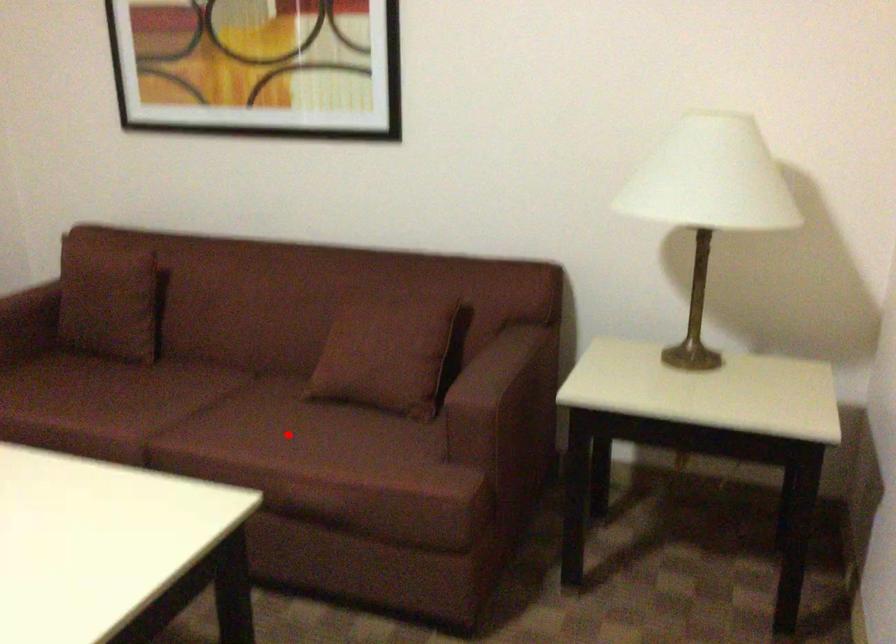
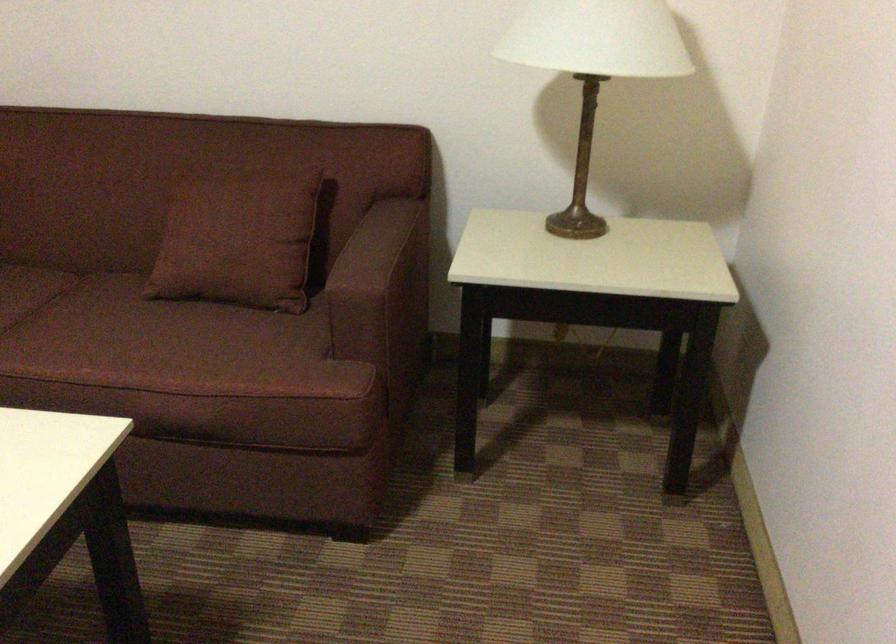
Question: I am providing you with two images of the same scene from different viewpoints. Image1 has a red point marked. In image2, the corresponding 3D location appears at what relative position? Reply with the corresponding letter.

Choices:
 (A) Closer
 (B) Farther

Answer: (A)